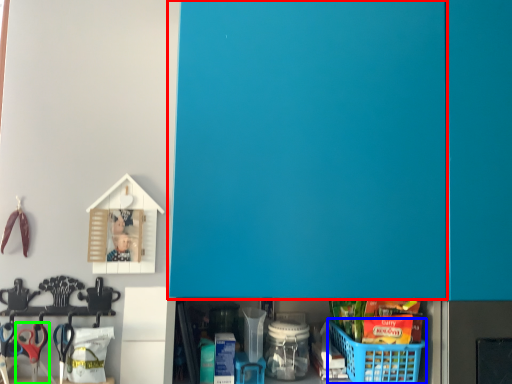
Question: Which is farther away from door (highlighted by a red box)? basket (highlighted by a blue box) or scissors (highlighted by a green box)?

Choices:
 (A) basket
 (B) scissors

Answer: (B)